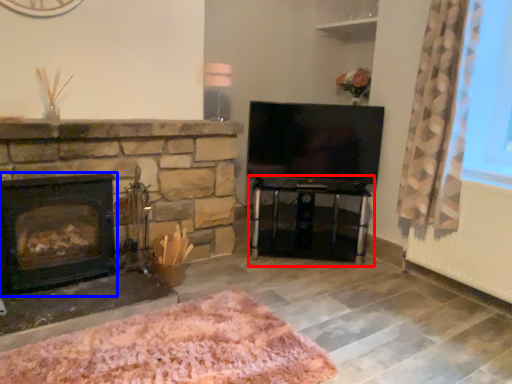
Question: Which object is closer to the camera taking this photo, table (highlighted by a red box) or wood burning stove (highlighted by a blue box)?

Choices:
 (A) table
 (B) wood burning stove

Answer: (B)